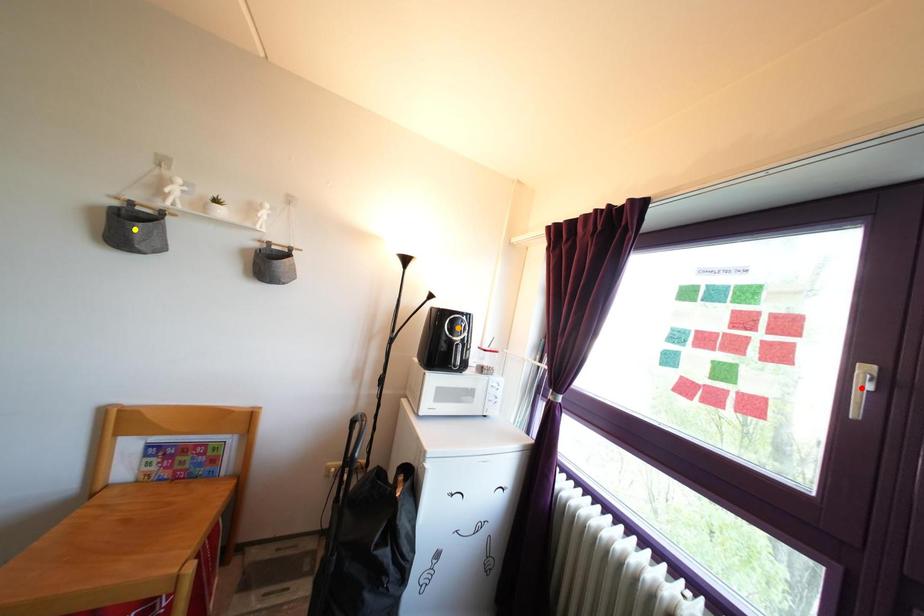
In the scene shown: Order these from nearest to farthest:
orange point
yellow point
red point

Answer: orange point → yellow point → red point